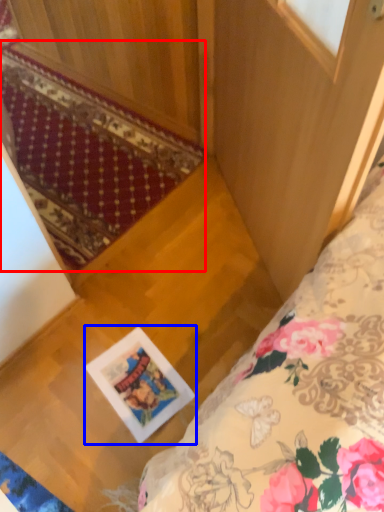
Question: Which point is further to the camera, mat (highlighted by a red box) or picture frame (highlighted by a blue box)?

Choices:
 (A) mat
 (B) picture frame

Answer: (B)